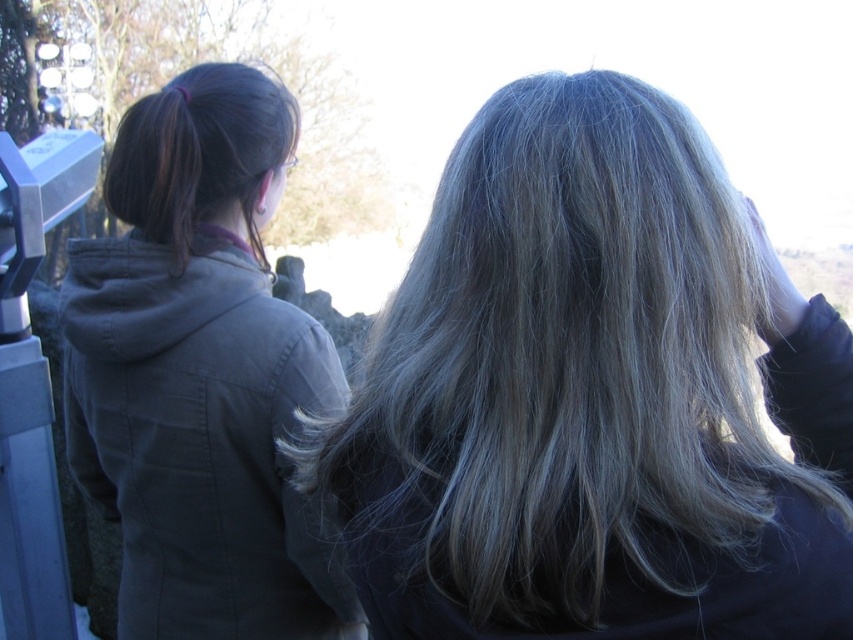
Question: Which object is the closest to the dark gray hoodie at left?

Choices:
 (A) dark brown silky hair at upper left
 (B) blonde hair at center

Answer: (A)

Question: Can you confirm if blonde hair at center is thinner than dark brown silky hair at upper left?

Choices:
 (A) yes
 (B) no

Answer: (B)

Question: Among these objects, which one is farthest from the camera?

Choices:
 (A) blonde hair at center
 (B) dark gray hoodie at left

Answer: (B)

Question: Can you confirm if blonde hair at center is wider than dark gray hoodie at left?

Choices:
 (A) yes
 (B) no

Answer: (B)

Question: Which point is farther to the camera?

Choices:
 (A) (190, 104)
 (B) (264, 452)
 (C) (592, 301)

Answer: (A)

Question: Is blonde hair at center thinner than dark gray hoodie at left?

Choices:
 (A) yes
 (B) no

Answer: (A)